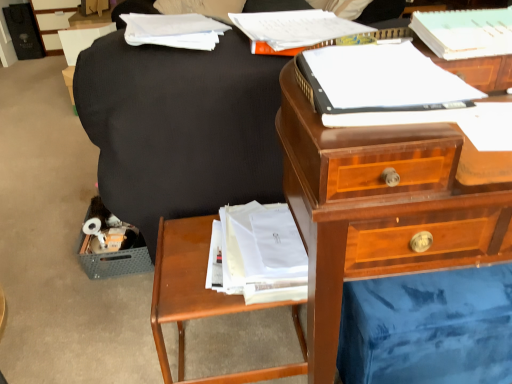
Looking at this image, in order to face white paper at upper left, should I rotate leftwards or rightwards?

It's best to rotate left around 11.050 degrees.

Where is `light green paper at upper right, the second paperback book in the front-to-back sequence`? The width and height of the screenshot is (512, 384). light green paper at upper right, the second paperback book in the front-to-back sequence is located at coordinates (465, 32).

The image size is (512, 384). I want to click on matte black swivel chair at center, so click(x=179, y=125).

What do you see at coordinates (293, 30) in the screenshot?
I see `white paper at upper center, marked as the 3th paperback book in a front-to-back arrangement` at bounding box center [293, 30].

Find the location of a particular element. Image resolution: width=512 pixels, height=384 pixels. white paper at upper left is located at coordinates (173, 30).

Measure the distance from matte black file cabinet at upper left to wooden nightstand at lower left.

The distance of matte black file cabinet at upper left from wooden nightstand at lower left is 3.11 meters.

From a real-world perspective, which is physically above, matte black file cabinet at upper left or wooden nightstand at lower left?

In real-world perspective, matte black file cabinet at upper left is above.

From the image's perspective, is matte black file cabinet at upper left over wooden nightstand at lower left?

Correct, matte black file cabinet at upper left appears higher than wooden nightstand at lower left in the image.

Is point (58, 8) less distant than point (175, 267)?

No.

Would you say matte black swivel chair at center is part of matte black file cabinet at upper left's contents?

No, matte black swivel chair at center is not a part of matte black file cabinet at upper left.

Locate an element on the screen. The width and height of the screenshot is (512, 384). file cabinet on the left of matte black swivel chair at center is located at coordinates (53, 20).

Which object is wider, matte black file cabinet at upper left or matte black swivel chair at center?

With larger width is matte black swivel chair at center.

Could you tell me if matte black file cabinet at upper left is turned towards matte black swivel chair at center?

No, matte black file cabinet at upper left is not facing towards matte black swivel chair at center.

Would you consider white paper at upper center, marked as the 3th paperback book in a front-to-back arrangement, to be distant from white paper at upper right, acting as the 1th paperback book starting from the front?

No, white paper at upper center, marked as the 3th paperback book in a front-to-back arrangement, is not far from white paper at upper right, acting as the 1th paperback book starting from the front.

Is white paper at upper center, marked as the 3th paperback book in a front-to-back arrangement, aimed at white paper at upper right, acting as the 1th paperback book starting from the front?

Yes, white paper at upper center, marked as the 3th paperback book in a front-to-back arrangement, is turned towards white paper at upper right, acting as the 1th paperback book starting from the front.

Considering the points (331, 18) and (391, 59), which point is in front, point (331, 18) or point (391, 59)?

The point (391, 59) is closer.

From a real-world perspective, who is located higher, white paper at upper center, placed as the 1th paperback book when sorted from back to front, or white paper at upper right, which is counted as the third paperback book, starting from the back?

white paper at upper right, which is counted as the third paperback book, starting from the back, from a real-world perspective.

Is white paper at upper right, which is counted as the third paperback book, starting from the back, surrounded by light green paper at upper right, placed as the 2th paperback book when sorted from back to front?

No, light green paper at upper right, placed as the 2th paperback book when sorted from back to front, does not contain white paper at upper right, which is counted as the third paperback book, starting from the back.

Is light green paper at upper right, the second paperback book in the front-to-back sequence, to the left or to the right of white paper at upper right, acting as the 1th paperback book starting from the front, in the image?

Clearly, light green paper at upper right, the second paperback book in the front-to-back sequence, is on the right of white paper at upper right, acting as the 1th paperback book starting from the front, in the image.

Is light green paper at upper right, the second paperback book in the front-to-back sequence, oriented away from white paper at upper right, which is counted as the third paperback book, starting from the back?

That's not correct — light green paper at upper right, the second paperback book in the front-to-back sequence, is not looking away from white paper at upper right, which is counted as the third paperback book, starting from the back.

Are light green paper at upper right, the second paperback book in the front-to-back sequence, and white paper at upper right, which is counted as the third paperback book, starting from the back, located far from each other?

No, light green paper at upper right, the second paperback book in the front-to-back sequence, is in close proximity to white paper at upper right, which is counted as the third paperback book, starting from the back.

Could you measure the distance between matte black file cabinet at upper left and light green paper at upper right, placed as the 2th paperback book when sorted from back to front?

matte black file cabinet at upper left and light green paper at upper right, placed as the 2th paperback book when sorted from back to front, are 3.47 meters apart from each other.

Which object is positioned more to the right, matte black file cabinet at upper left or light green paper at upper right, the second paperback book in the front-to-back sequence?

light green paper at upper right, the second paperback book in the front-to-back sequence.

Can you confirm if matte black file cabinet at upper left is taller than light green paper at upper right, the second paperback book in the front-to-back sequence?

Yes.

Where is `file cabinet directly beneath the light green paper at upper right, the second paperback book in the front-to-back sequence (from a real-world perspective)`? file cabinet directly beneath the light green paper at upper right, the second paperback book in the front-to-back sequence (from a real-world perspective) is located at coordinates (53, 20).

Considering the points (150, 16) and (306, 347), which point is behind, point (150, 16) or point (306, 347)?

Positioned behind is point (150, 16).

In terms of size, does white paper at upper left appear bigger or smaller than wooden nightstand at lower left?

In the image, white paper at upper left appears to be smaller than wooden nightstand at lower left.

Can you confirm if white paper at upper left is shorter than wooden nightstand at lower left?

Indeed, white paper at upper left has a lesser height compared to wooden nightstand at lower left.

From the image's perspective, is wooden nightstand at lower left above white paper at upper right, acting as the 1th paperback book starting from the front?

Incorrect, from the image's perspective, wooden nightstand at lower left is lower than white paper at upper right, acting as the 1th paperback book starting from the front.

Is wooden nightstand at lower left next to white paper at upper right, which is counted as the third paperback book, starting from the back, and touching it?

No, wooden nightstand at lower left is not beside white paper at upper right, which is counted as the third paperback book, starting from the back.

Is wooden nightstand at lower left spatially inside white paper at upper right, acting as the 1th paperback book starting from the front, or outside of it?

wooden nightstand at lower left exists outside the volume of white paper at upper right, acting as the 1th paperback book starting from the front.

The width and height of the screenshot is (512, 384). In order to click on the 1st paperback book above the wooden nightstand at lower left (from the image's perspective) in this screenshot , I will do `click(381, 86)`.

Locate an element on the screen. The height and width of the screenshot is (384, 512). file cabinet behind the wooden nightstand at lower left is located at coordinates (53, 20).

Find the location of a particular element. The width and height of the screenshot is (512, 384). file cabinet located above the matte black swivel chair at center (from the image's perspective) is located at coordinates (53, 20).

Looking at the image, which one is located closer to wooden nightstand at lower left, white paper at upper right, which is counted as the third paperback book, starting from the back, or white paper at upper center, marked as the 3th paperback book in a front-to-back arrangement?

white paper at upper right, which is counted as the third paperback book, starting from the back, is closer to wooden nightstand at lower left.

From the image, which object appears to be farther from wooden nightstand at lower left, matte black file cabinet at upper left or white paper at upper left?

matte black file cabinet at upper left.

Considering their positions, is white paper at upper center, placed as the 1th paperback book when sorted from back to front, positioned closer to white paper at upper left than matte black swivel chair at center?

The object closer to white paper at upper left is matte black swivel chair at center.

Looking at the image, which one is located closer to white paper at upper center, placed as the 1th paperback book when sorted from back to front, white paper at upper left or wooden nightstand at lower left?

Among the two, white paper at upper left is located nearer to white paper at upper center, placed as the 1th paperback book when sorted from back to front.

When comparing their distances from matte black swivel chair at center, does matte black file cabinet at upper left or white paper at upper left seem further?

matte black file cabinet at upper left.

Based on their spatial positions, is wooden nightstand at lower left or white paper at upper left further from matte black swivel chair at center?

wooden nightstand at lower left is positioned further to the anchor matte black swivel chair at center.

Based on their spatial positions, is white paper at upper center, marked as the 3th paperback book in a front-to-back arrangement, or wooden nightstand at lower left further from matte black swivel chair at center?

Based on the image, wooden nightstand at lower left appears to be further to matte black swivel chair at center.

When comparing their distances from white paper at upper center, placed as the 1th paperback book when sorted from back to front, does white paper at upper left or white paper at upper right, which is counted as the third paperback book, starting from the back, seem closer?

Among the two, white paper at upper left is located nearer to white paper at upper center, placed as the 1th paperback book when sorted from back to front.

The width and height of the screenshot is (512, 384). I want to click on book between white paper at upper right, acting as the 1th paperback book starting from the front, and matte black file cabinet at upper left from front to back, so click(173, 30).

Find the location of a particular element. swivel chair between white paper at upper left and wooden nightstand at lower left vertically is located at coordinates (179, 125).

In order to click on nightstand between white paper at upper right, which is counted as the third paperback book, starting from the back, and matte black file cabinet at upper left in the front-back direction in this screenshot , I will do `click(200, 298)`.

This screenshot has height=384, width=512. Find the location of `book between wooden nightstand at lower left and matte black file cabinet at upper left from front to back`. book between wooden nightstand at lower left and matte black file cabinet at upper left from front to back is located at coordinates (173, 30).